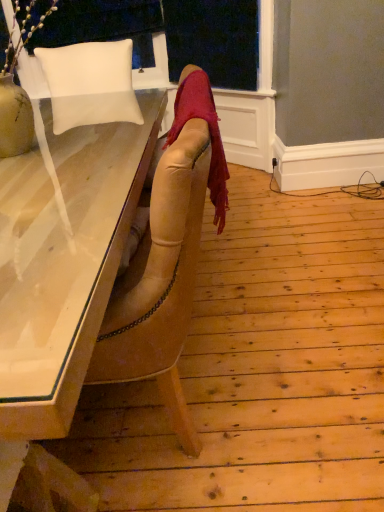
Question: Can you confirm if white leather chair at upper left is wider than white matte pillow at upper left?

Choices:
 (A) no
 (B) yes

Answer: (A)

Question: Does white leather chair at upper left have a smaller size compared to white matte pillow at upper left?

Choices:
 (A) no
 (B) yes

Answer: (B)

Question: Is the depth of white leather chair at upper left greater than that of white matte pillow at upper left?

Choices:
 (A) yes
 (B) no

Answer: (A)

Question: From a real-world perspective, is white leather chair at upper left located beneath white matte pillow at upper left?

Choices:
 (A) no
 (B) yes

Answer: (A)

Question: Does white leather chair at upper left appear on the right side of white matte pillow at upper left?

Choices:
 (A) no
 (B) yes

Answer: (A)

Question: From the image's perspective, is velvet red scarf at center positioned above or below white matte pillow at upper left?

Choices:
 (A) below
 (B) above

Answer: (A)

Question: Do you think velvet red scarf at center is within white matte pillow at upper left, or outside of it?

Choices:
 (A) outside
 (B) inside

Answer: (A)

Question: In terms of size, does velvet red scarf at center appear bigger or smaller than white matte pillow at upper left?

Choices:
 (A) small
 (B) big

Answer: (A)

Question: Considering their positions, is velvet red scarf at center located in front of or behind white matte pillow at upper left?

Choices:
 (A) behind
 (B) front

Answer: (B)

Question: Is white matte pillow at upper left bigger or smaller than white leather chair at upper left?

Choices:
 (A) small
 (B) big

Answer: (B)

Question: From their relative heights in the image, would you say white matte pillow at upper left is taller or shorter than white leather chair at upper left?

Choices:
 (A) short
 (B) tall

Answer: (A)

Question: Considering the positions of point (122, 68) and point (190, 31), is point (122, 68) closer or farther from the camera than point (190, 31)?

Choices:
 (A) farther
 (B) closer

Answer: (B)

Question: Is white matte pillow at upper left in front of or behind white leather chair at upper left in the image?

Choices:
 (A) behind
 (B) front

Answer: (B)

Question: Visually, is white leather chair at upper left positioned to the left or to the right of velvet red scarf at center?

Choices:
 (A) right
 (B) left

Answer: (B)

Question: Based on their sizes in the image, would you say white leather chair at upper left is bigger or smaller than velvet red scarf at center?

Choices:
 (A) small
 (B) big

Answer: (B)